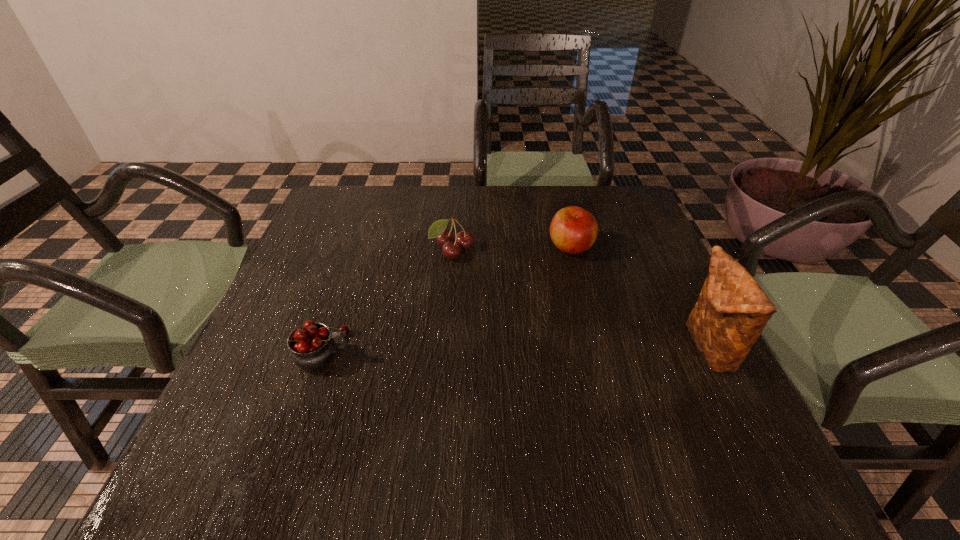
This screenshot has width=960, height=540. Find the location of `free space at the near edge of the desktop`. free space at the near edge of the desktop is located at coordinates (603, 403).

In the image, there is a desktop. Where is `free space at the left edge`? The height and width of the screenshot is (540, 960). free space at the left edge is located at coordinates (361, 242).

Where is `free space at the right edge of the desktop`? The width and height of the screenshot is (960, 540). free space at the right edge of the desktop is located at coordinates (645, 349).

The width and height of the screenshot is (960, 540). I want to click on vacant space at the far left corner of the desktop, so click(x=345, y=222).

The height and width of the screenshot is (540, 960). In order to click on vacant space at the far right corner in this screenshot , I will do `click(627, 202)`.

The width and height of the screenshot is (960, 540). In order to click on vacant area at the near right corner of the desktop in this screenshot , I will do `click(743, 424)`.

Identify the location of empty space that is in between the nearer cherry and the shorter cherry. This screenshot has width=960, height=540. (389, 301).

The width and height of the screenshot is (960, 540). Identify the location of free area in between the apple and the left cherry. click(448, 299).

The width and height of the screenshot is (960, 540). What are the coordinates of `vacant area that lies between the tallest object and the shorter cherry` in the screenshot? It's located at (580, 300).

Identify the location of vacant area between the shorter cherry and the second object from right to left. (512, 249).